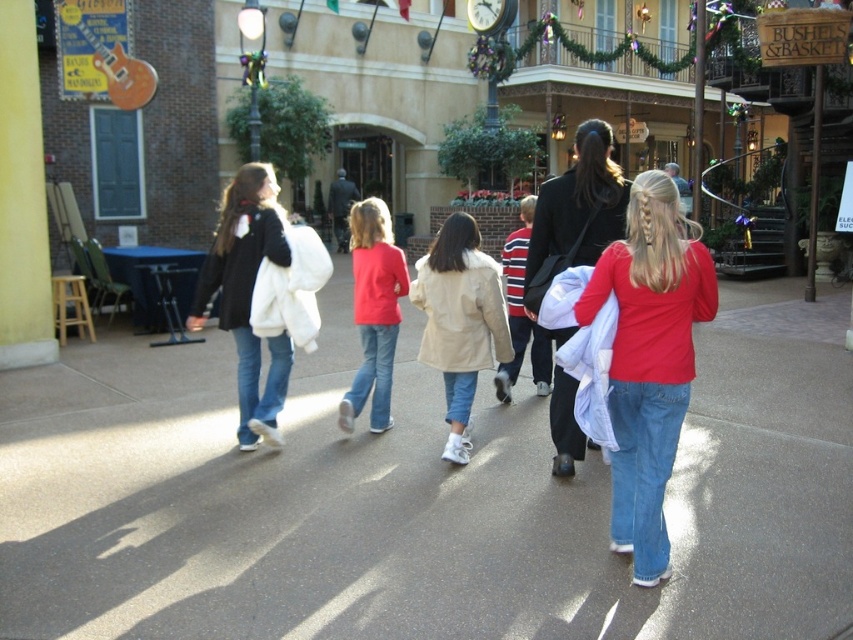
Question: Can you confirm if white fluffy coat at center is smaller than beige fur-trimmed coat at center?

Choices:
 (A) yes
 (B) no

Answer: (A)

Question: Does white fluffy coat at center appear on the right side of matte black coat at center?

Choices:
 (A) yes
 (B) no

Answer: (B)

Question: Does matte red shirt at center come in front of matte black coat at center?

Choices:
 (A) no
 (B) yes

Answer: (B)

Question: Considering the real-world distances, which object is farthest from the matte black coat at center?

Choices:
 (A) white fluffy coat at center
 (B) matte red sweater at center
 (C) matte red shirt at center

Answer: (A)

Question: Which point is farther to the camera?

Choices:
 (A) matte black coat at center
 (B) matte red shirt at center
 (C) matte red sweater at center
 (D) beige fur-trimmed coat at center

Answer: (C)

Question: Which object is closer to the camera taking this photo?

Choices:
 (A) smooth concrete pavement at center
 (B) matte black coat at center

Answer: (A)